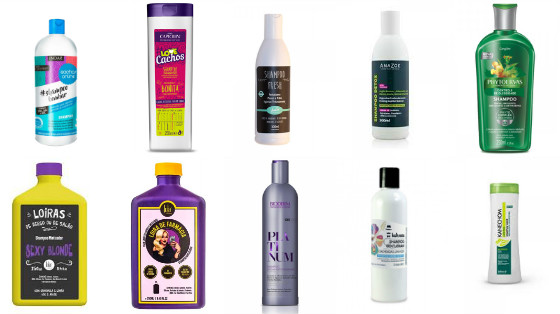
You are a GUI agent. You are given a task and a screenshot of the screen. Output one action in this format:
    pyautogui.click(x=<x>, y=<y>)
    Task: Click on the bottles
    
    Given the screenshot: What is the action you would take?
    pyautogui.click(x=68, y=83), pyautogui.click(x=181, y=74), pyautogui.click(x=270, y=90), pyautogui.click(x=500, y=63), pyautogui.click(x=401, y=81), pyautogui.click(x=501, y=213), pyautogui.click(x=393, y=223), pyautogui.click(x=288, y=229), pyautogui.click(x=184, y=224), pyautogui.click(x=56, y=232)